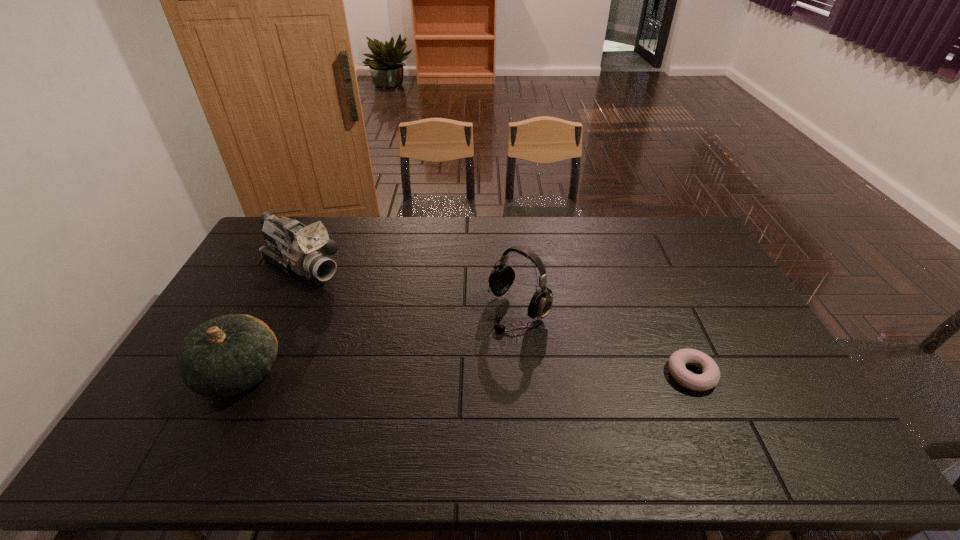
Identify the location of gourd. (225, 356).

Identify the location of the rightmost object. (710, 376).

This screenshot has height=540, width=960. What are the coordinates of `doughnut` in the screenshot? It's located at (710, 376).

Locate an element on the screen. camcorder is located at coordinates (293, 247).

The image size is (960, 540). Find the location of `headset`. headset is located at coordinates (501, 278).

At what (x,y) coordinates should I click in order to perform the action: click on free space located 0.370m on the back of the gourd. Please return your answer as a coordinate pair (x, y). Looking at the image, I should click on (296, 262).

The image size is (960, 540). Identify the location of free spot located on the left of the doughnut. (554, 375).

This screenshot has height=540, width=960. I want to click on free space located on the front-facing side of the camcorder, so click(411, 334).

Locate an element on the screen. The image size is (960, 540). vacant space situated 0.210m on the front-facing side of the camcorder is located at coordinates (372, 309).

Where is `vacant space located 0.320m on the front-facing side of the camcorder`? The height and width of the screenshot is (540, 960). vacant space located 0.320m on the front-facing side of the camcorder is located at coordinates (396, 325).